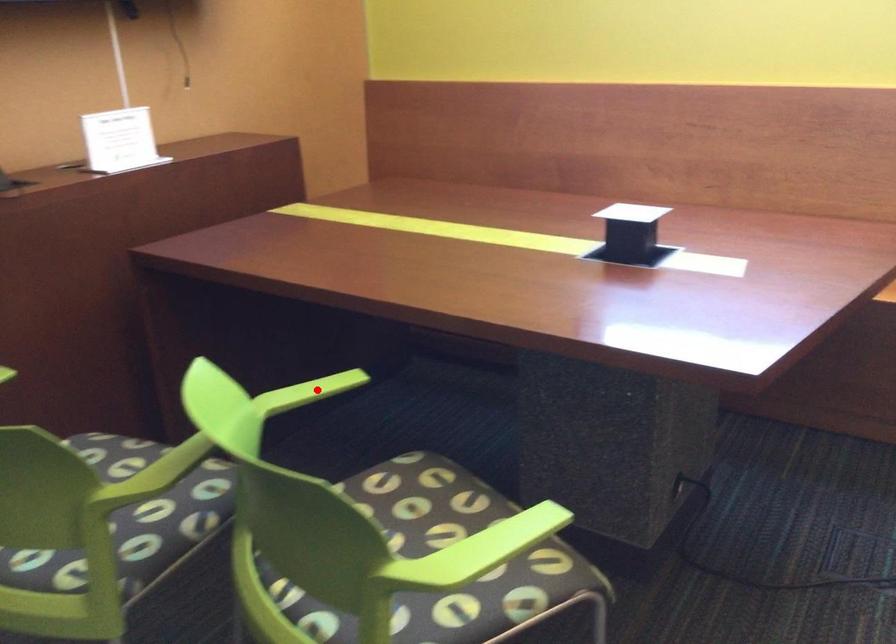
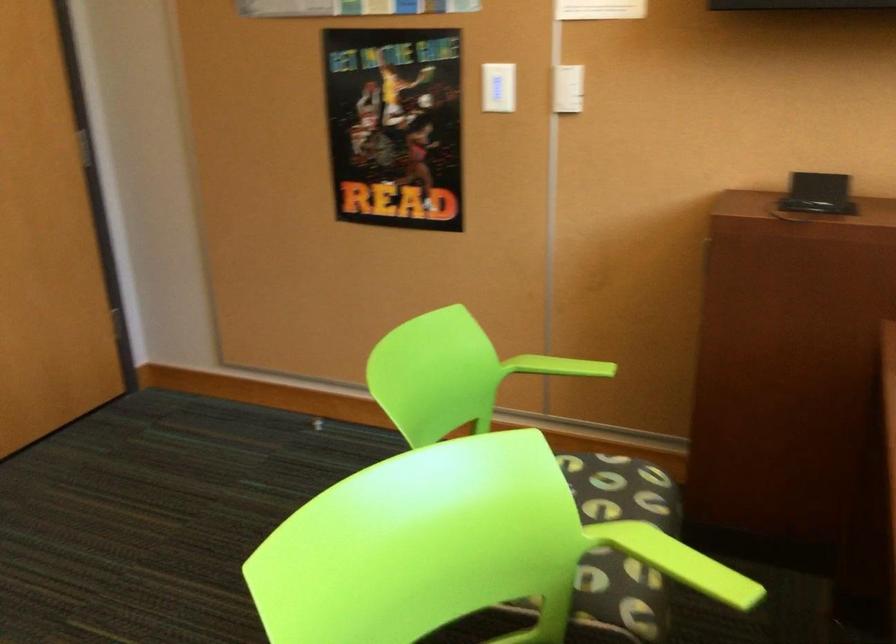
Question: I am providing you with two images of the same scene from different viewpoints. Image1 has a red point marked. In image2, the corresponding 3D location appears at what relative position? Reply with the corresponding letter.

Choices:
 (A) Closer
 (B) Farther

Answer: (A)